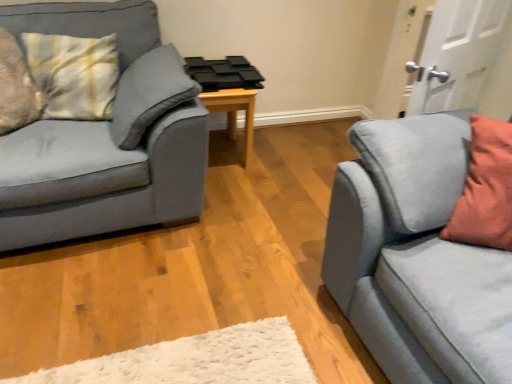
The width and height of the screenshot is (512, 384). Describe the element at coordinates (467, 59) in the screenshot. I see `white matte door at upper right` at that location.

Describe the element at coordinates (99, 143) in the screenshot. I see `matte blue couch at left, the first studio couch in the left-to-right sequence` at that location.

The image size is (512, 384). I want to click on white matte door at upper right, so click(x=467, y=59).

Looking at this image, is suede blue studio couch at right, the first studio couch from the right, further to the viewer compared to white matte door at upper right?

No, suede blue studio couch at right, the first studio couch from the right, is closer to the viewer.

Can you tell me how much suede blue studio couch at right, which ranks as the second studio couch in left-to-right order, and white matte door at upper right differ in facing direction?

suede blue studio couch at right, which ranks as the second studio couch in left-to-right order, and white matte door at upper right are facing 68 degrees away from each other.

From a real-world perspective, is suede blue studio couch at right, the first studio couch from the right, on top of white matte door at upper right?

No.

Is point (416, 257) closer to camera compared to point (479, 83)?

That is True.

How far apart are wooden table at center and suede blue studio couch at right, the first studio couch from the right?

A distance of 1.27 meters exists between wooden table at center and suede blue studio couch at right, the first studio couch from the right.

This screenshot has width=512, height=384. I want to click on the 2nd studio couch above the wooden table at center (from a real-world perspective), so click(416, 256).

Is wooden table at center turned away from suede blue studio couch at right, the first studio couch from the right?

No, wooden table at center is not facing away from suede blue studio couch at right, the first studio couch from the right.

From the image's perspective, which is above, wooden table at center or suede blue studio couch at right, the first studio couch from the right?

From the image's view, wooden table at center is above.

In the scene shown: Considering the positions of objects white matte door at upper right and matte blue couch at left, the first studio couch in the left-to-right sequence, in the image provided, who is more to the right, white matte door at upper right or matte blue couch at left, the first studio couch in the left-to-right sequence,?

white matte door at upper right is more to the right.

From the image's perspective, which is above, white matte door at upper right or matte blue couch at left, the first studio couch in the left-to-right sequence?

white matte door at upper right is shown above in the image.

Which of these two, white matte door at upper right or matte blue couch at left, the first studio couch in the left-to-right sequence, is bigger?

With larger size is matte blue couch at left, the first studio couch in the left-to-right sequence.

From the picture: Does white matte door at upper right contain matte blue couch at left, which is the 2th studio couch from right to left?

No, white matte door at upper right does not contain matte blue couch at left, which is the 2th studio couch from right to left.

Are suede blue studio couch at right, which ranks as the second studio couch in left-to-right order, and wooden table at center located far from each other?

Yes, suede blue studio couch at right, which ranks as the second studio couch in left-to-right order, and wooden table at center are located far from each other.

From a real-world perspective, who is located lower, suede blue studio couch at right, which ranks as the second studio couch in left-to-right order, or wooden table at center?

wooden table at center.

Considering the positions of objects suede blue studio couch at right, which ranks as the second studio couch in left-to-right order, and wooden table at center in the image provided, who is more to the left, suede blue studio couch at right, which ranks as the second studio couch in left-to-right order, or wooden table at center?

From the viewer's perspective, wooden table at center appears more on the left side.

Where is `studio couch on the right of the wooden table at center`? studio couch on the right of the wooden table at center is located at coordinates (416, 256).

Is matte blue couch at left, the first studio couch in the left-to-right sequence, in front of wooden table at center?

Yes, matte blue couch at left, the first studio couch in the left-to-right sequence, is closer to the viewer.

Based on the photo, is matte blue couch at left, which is the 2th studio couch from right to left, wider or thinner than wooden table at center?

Clearly, matte blue couch at left, which is the 2th studio couch from right to left, has more width compared to wooden table at center.

Does matte blue couch at left, which is the 2th studio couch from right to left, appear on the right side of wooden table at center?

Incorrect, matte blue couch at left, which is the 2th studio couch from right to left, is not on the right side of wooden table at center.

Do you think white matte door at upper right is within suede blue studio couch at right, the first studio couch from the right, or outside of it?

white matte door at upper right is not inside suede blue studio couch at right, the first studio couch from the right, it's outside.

Who is bigger, white matte door at upper right or suede blue studio couch at right, the first studio couch from the right?

Bigger between the two is suede blue studio couch at right, the first studio couch from the right.

Is white matte door at upper right facing towards suede blue studio couch at right, which ranks as the second studio couch in left-to-right order?

No, white matte door at upper right is not oriented towards suede blue studio couch at right, which ranks as the second studio couch in left-to-right order.

Is wooden table at center located outside matte blue couch at left, which is the 2th studio couch from right to left?

Yes, wooden table at center is located beyond the bounds of matte blue couch at left, which is the 2th studio couch from right to left.

In the image, is wooden table at center on the left side or the right side of matte blue couch at left, the first studio couch in the left-to-right sequence?

From the image, it's evident that wooden table at center is to the right of matte blue couch at left, the first studio couch in the left-to-right sequence.

Does point (251, 139) lie behind point (84, 205)?

Yes, it is.

Does wooden table at center have a greater height compared to matte blue couch at left, the first studio couch in the left-to-right sequence?

No, wooden table at center is not taller than matte blue couch at left, the first studio couch in the left-to-right sequence.

Find the location of `the 2nd studio couch in front when counting from the white matte door at upper right`. the 2nd studio couch in front when counting from the white matte door at upper right is located at coordinates (416, 256).

Identify the location of table above the suede blue studio couch at right, which ranks as the second studio couch in left-to-right order (from the image's perspective). This screenshot has width=512, height=384. (234, 113).

Which object lies further to the anchor point suede blue studio couch at right, the first studio couch from the right, matte blue couch at left, the first studio couch in the left-to-right sequence, or wooden table at center?

The object further to suede blue studio couch at right, the first studio couch from the right, is wooden table at center.

Estimate the real-world distances between objects in this image. Which object is further from matte blue couch at left, which is the 2th studio couch from right to left, suede blue studio couch at right, which ranks as the second studio couch in left-to-right order, or wooden table at center?

Based on the image, suede blue studio couch at right, which ranks as the second studio couch in left-to-right order, appears to be further to matte blue couch at left, which is the 2th studio couch from right to left.

Based on their spatial positions, is suede blue studio couch at right, which ranks as the second studio couch in left-to-right order, or matte blue couch at left, which is the 2th studio couch from right to left, further from wooden table at center?

Based on the image, suede blue studio couch at right, which ranks as the second studio couch in left-to-right order, appears to be further to wooden table at center.

When comparing their distances from suede blue studio couch at right, the first studio couch from the right, does white matte door at upper right or matte blue couch at left, the first studio couch in the left-to-right sequence, seem further?

Among the two, matte blue couch at left, the first studio couch in the left-to-right sequence, is located further to suede blue studio couch at right, the first studio couch from the right.

When comparing their distances from white matte door at upper right, does suede blue studio couch at right, the first studio couch from the right, or matte blue couch at left, which is the 2th studio couch from right to left, seem further?

matte blue couch at left, which is the 2th studio couch from right to left, lies further to white matte door at upper right than the other object.

From the picture: Looking at the image, which one is located closer to white matte door at upper right, wooden table at center or matte blue couch at left, which is the 2th studio couch from right to left?

Among the two, wooden table at center is located nearer to white matte door at upper right.

Which object lies nearer to the anchor point wooden table at center, white matte door at upper right or matte blue couch at left, which is the 2th studio couch from right to left?

matte blue couch at left, which is the 2th studio couch from right to left, lies closer to wooden table at center than the other object.

Looking at the image, which one is located further to matte blue couch at left, which is the 2th studio couch from right to left, white matte door at upper right or wooden table at center?

white matte door at upper right is further to matte blue couch at left, which is the 2th studio couch from right to left.

At what (x,y) coordinates should I click in order to perform the action: click on door between suede blue studio couch at right, which ranks as the second studio couch in left-to-right order, and wooden table at center in the front-back direction. Please return your answer as a coordinate pair (x, y). Looking at the image, I should click on (467, 59).

The width and height of the screenshot is (512, 384). What are the coordinates of `studio couch between matte blue couch at left, the first studio couch in the left-to-right sequence, and white matte door at upper right from left to right` in the screenshot? It's located at (416, 256).

Find the location of `table located between matte blue couch at left, the first studio couch in the left-to-right sequence, and suede blue studio couch at right, which ranks as the second studio couch in left-to-right order, in the left-right direction`. table located between matte blue couch at left, the first studio couch in the left-to-right sequence, and suede blue studio couch at right, which ranks as the second studio couch in left-to-right order, in the left-right direction is located at coordinates (234, 113).

The width and height of the screenshot is (512, 384). Identify the location of table situated between matte blue couch at left, which is the 2th studio couch from right to left, and white matte door at upper right from left to right. (234, 113).